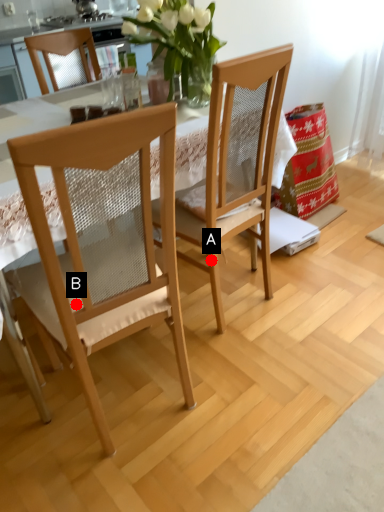
Question: Two points are circled on the image, labeled by A and B beside each circle. Among these points, which one is farthest from the camera?

Choices:
 (A) A is further
 (B) B is further

Answer: (A)